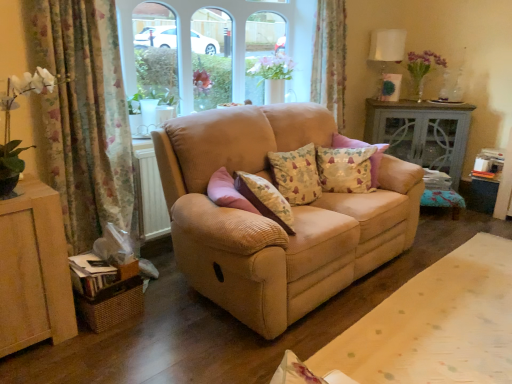
Question: From a real-world perspective, is floral fabric pillow at center, the 1th pillow from the right, below beige fabric sofa at center?

Choices:
 (A) no
 (B) yes

Answer: (B)

Question: Considering the relative sizes of floral fabric pillow at center, the 1th pillow from the right, and beige fabric sofa at center in the image provided, is floral fabric pillow at center, the 1th pillow from the right, smaller than beige fabric sofa at center?

Choices:
 (A) yes
 (B) no

Answer: (A)

Question: From a real-world perspective, is floral fabric pillow at center, the 1th pillow from the right, located higher than beige fabric sofa at center?

Choices:
 (A) no
 (B) yes

Answer: (A)

Question: Is floral fabric pillow at center, the 1th pillow from the right, touching beige fabric sofa at center?

Choices:
 (A) no
 (B) yes

Answer: (A)

Question: Considering the relative sizes of floral fabric pillow at center, which is counted as the second pillow, starting from the left, and beige fabric sofa at center in the image provided, is floral fabric pillow at center, which is counted as the second pillow, starting from the left, wider than beige fabric sofa at center?

Choices:
 (A) no
 (B) yes

Answer: (A)

Question: Is floral fabric pillow at center, the 1th pillow from the right, to the left of beige fabric sofa at center from the viewer's perspective?

Choices:
 (A) yes
 (B) no

Answer: (B)

Question: Could floral fabric curtain at left, acting as the second curtain starting from the back, be considered to be inside matte gray cabinet at right?

Choices:
 (A) no
 (B) yes

Answer: (A)

Question: Is matte gray cabinet at right not within floral fabric curtain at left, the first curtain when ordered from front to back?

Choices:
 (A) yes
 (B) no

Answer: (A)

Question: Are matte gray cabinet at right and floral fabric curtain at left, acting as the second curtain starting from the back, located far from each other?

Choices:
 (A) yes
 (B) no

Answer: (A)

Question: From a real-world perspective, is matte gray cabinet at right on floral fabric curtain at left, the 1th curtain viewed from the left?

Choices:
 (A) no
 (B) yes

Answer: (A)

Question: Does matte gray cabinet at right appear on the left side of floral fabric curtain at left, the 1th curtain viewed from the left?

Choices:
 (A) no
 (B) yes

Answer: (A)

Question: Does matte gray cabinet at right have a larger size compared to floral fabric curtain at left, the first curtain when ordered from front to back?

Choices:
 (A) no
 (B) yes

Answer: (B)

Question: Does clear glass window at center have a lesser width compared to beige fabric sofa at center?

Choices:
 (A) no
 (B) yes

Answer: (B)